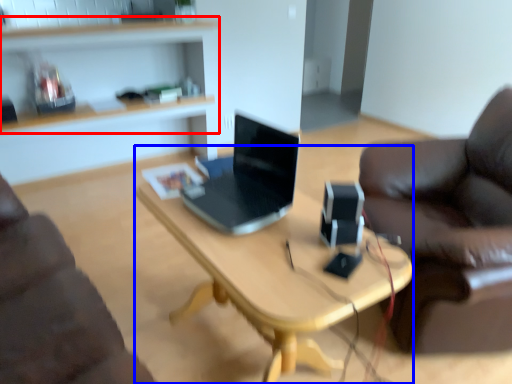
Question: Which of the following is the closest to the observer, shelf (highlighted by a red box) or desk (highlighted by a blue box)?

Choices:
 (A) shelf
 (B) desk

Answer: (B)